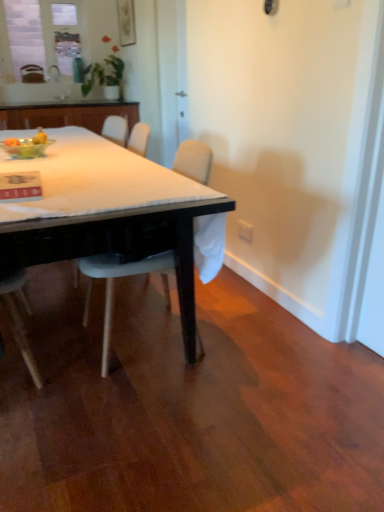
Identify the location of free location in front of white plastic chair at center, marked as the 2th chair in a back-to-front arrangement. (135, 409).